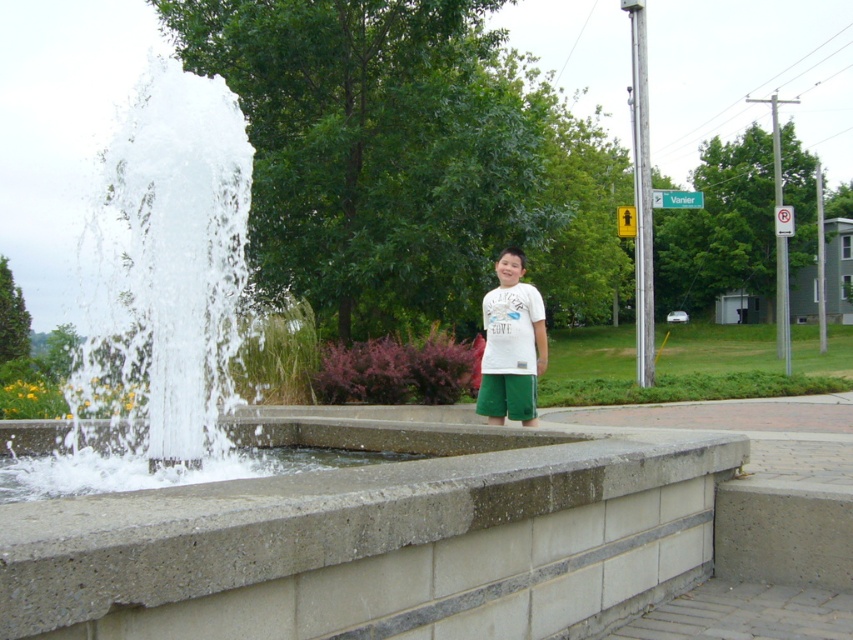
Question: Which of the following is the closest to the observer?

Choices:
 (A) white cotton shirt at center
 (B) concrete ledge at center

Answer: (B)

Question: Does concrete ledge at center come in front of white cotton shirt at center?

Choices:
 (A) no
 (B) yes

Answer: (B)

Question: Which object is farther from the camera taking this photo?

Choices:
 (A) concrete ledge at center
 (B) white cotton shirt at center

Answer: (B)

Question: Which object is closer to the camera taking this photo?

Choices:
 (A) concrete ledge at center
 (B) white cotton shirt at center

Answer: (A)

Question: Can you confirm if concrete ledge at center is positioned to the left of white cotton shirt at center?

Choices:
 (A) yes
 (B) no

Answer: (A)

Question: Can you confirm if concrete ledge at center is positioned to the right of white cotton shirt at center?

Choices:
 (A) no
 (B) yes

Answer: (A)